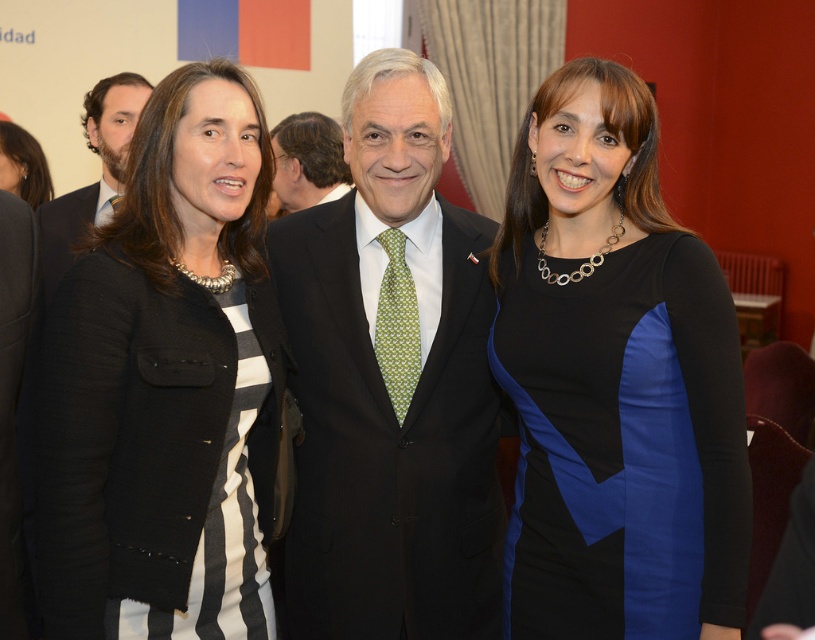
You are a photographer setting up for a group photo. You have two subjects wearing the black matte dress at center and the matte black suit at left. You need to ensure that the dress is positioned so it doesn not block the view of the suit. Based on their widths, is this arrangement possible?

The black matte dress at center might be wider than the matte black suit at left, so there is a possibility that the dress could block the view of the suit. To avoid this, you should position them in a way that accounts for their potential widths, perhaps placing the narrower suit closer to the camera or adjusting their stance.

You are a photographer adjusting the camera settings for a group photo. You notice the black matte dress at center and the matte black suit at left in your frame. Which clothing item appears taller in the photo?

The black matte dress at center appears taller than the matte black suit at left because the description states it is much taller.